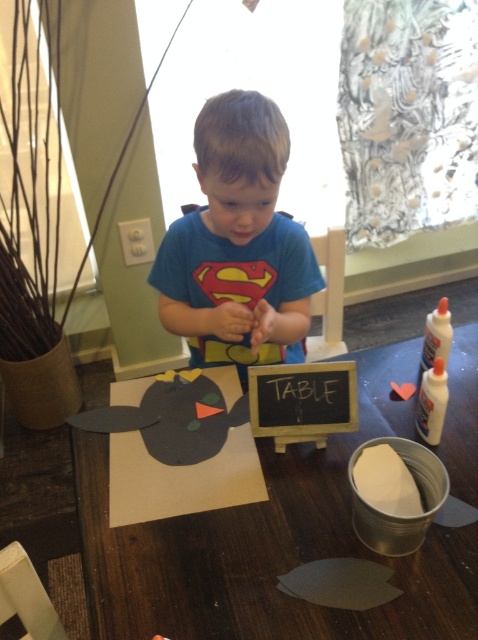
Question: Among these points, which one is farthest from the camera?

Choices:
 (A) (400, 380)
 (B) (195, 260)

Answer: (A)

Question: Which of the following is the closest to the observer?

Choices:
 (A) (229, 637)
 (B) (242, 106)

Answer: (A)

Question: Can you confirm if matte cardboard table at center is positioned to the right of blue cotton shirt at center?

Choices:
 (A) yes
 (B) no

Answer: (A)

Question: Does matte cardboard table at center appear over blue cotton shirt at center?

Choices:
 (A) yes
 (B) no

Answer: (B)

Question: Considering the relative positions of matte cardboard table at center and blue cotton shirt at center in the image provided, where is matte cardboard table at center located with respect to blue cotton shirt at center?

Choices:
 (A) left
 (B) right

Answer: (B)